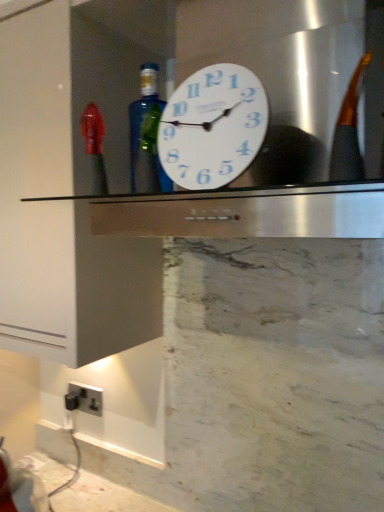
Question: Is satin silver plug socket at lower left looking in the opposite direction of white plastic clock at center?

Choices:
 (A) yes
 (B) no

Answer: (B)

Question: From the image's perspective, is satin silver plug socket at lower left on top of white plastic clock at center?

Choices:
 (A) no
 (B) yes

Answer: (A)

Question: Can you confirm if satin silver plug socket at lower left is thinner than white plastic clock at center?

Choices:
 (A) no
 (B) yes

Answer: (A)

Question: Does satin silver plug socket at lower left lie behind white plastic clock at center?

Choices:
 (A) yes
 (B) no

Answer: (A)

Question: Would you say satin silver plug socket at lower left is outside white plastic clock at center?

Choices:
 (A) no
 (B) yes

Answer: (B)

Question: Based on their positions, is blue glass bottle at center located to the left or right of satin silver plug socket at lower left?

Choices:
 (A) left
 (B) right

Answer: (B)

Question: Relative to satin silver plug socket at lower left, is blue glass bottle at center in front or behind?

Choices:
 (A) behind
 (B) front

Answer: (B)

Question: In terms of height, does blue glass bottle at center look taller or shorter compared to satin silver plug socket at lower left?

Choices:
 (A) tall
 (B) short

Answer: (A)

Question: Is blue glass bottle at center spatially inside satin silver plug socket at lower left, or outside of it?

Choices:
 (A) inside
 (B) outside

Answer: (B)

Question: From the image's perspective, relative to white plastic clock at center, is blue glass bottle at center above or below?

Choices:
 (A) above
 (B) below

Answer: (B)

Question: In the image, is blue glass bottle at center positioned in front of or behind white plastic clock at center?

Choices:
 (A) behind
 (B) front

Answer: (A)

Question: In terms of size, does blue glass bottle at center appear bigger or smaller than white plastic clock at center?

Choices:
 (A) big
 (B) small

Answer: (B)

Question: Choose the correct answer: Is blue glass bottle at center inside white plastic clock at center or outside it?

Choices:
 (A) inside
 (B) outside

Answer: (B)

Question: Considering the positions of satin silver plug socket at lower left and blue glass bottle at center in the image, is satin silver plug socket at lower left bigger or smaller than blue glass bottle at center?

Choices:
 (A) big
 (B) small

Answer: (B)

Question: In terms of height, does satin silver plug socket at lower left look taller or shorter compared to blue glass bottle at center?

Choices:
 (A) tall
 (B) short

Answer: (B)